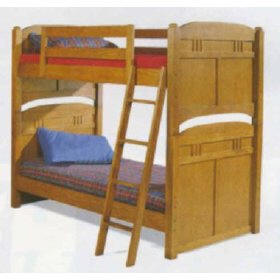
Where is `blue pillow`? Image resolution: width=280 pixels, height=280 pixels. blue pillow is located at coordinates (x=72, y=147).